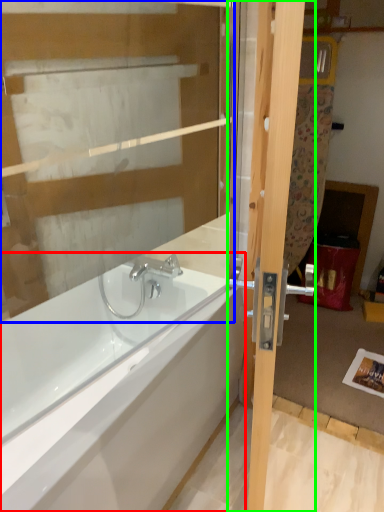
Question: Estimate the real-world distances between objects in this image. Which object is closer to bathtub (highlighted by a red box), glass door (highlighted by a blue box) or door (highlighted by a green box)?

Choices:
 (A) glass door
 (B) door

Answer: (B)